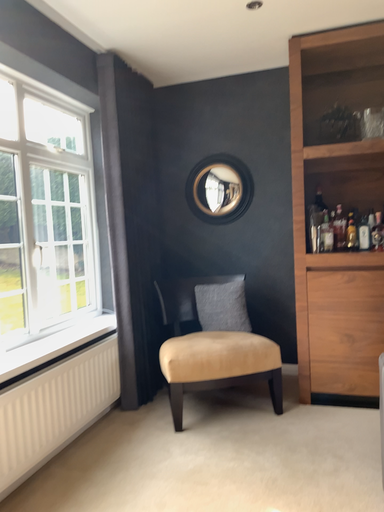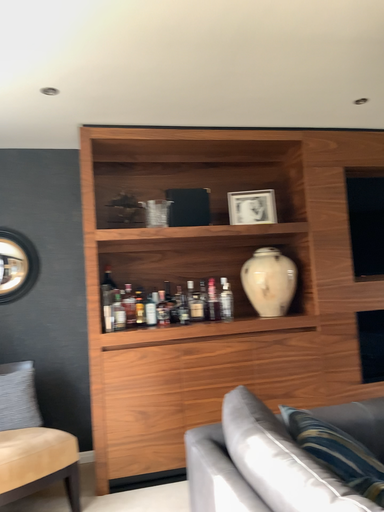
Question: How did the camera likely rotate when shooting the video?

Choices:
 (A) rotated upward
 (B) rotated downward

Answer: (A)